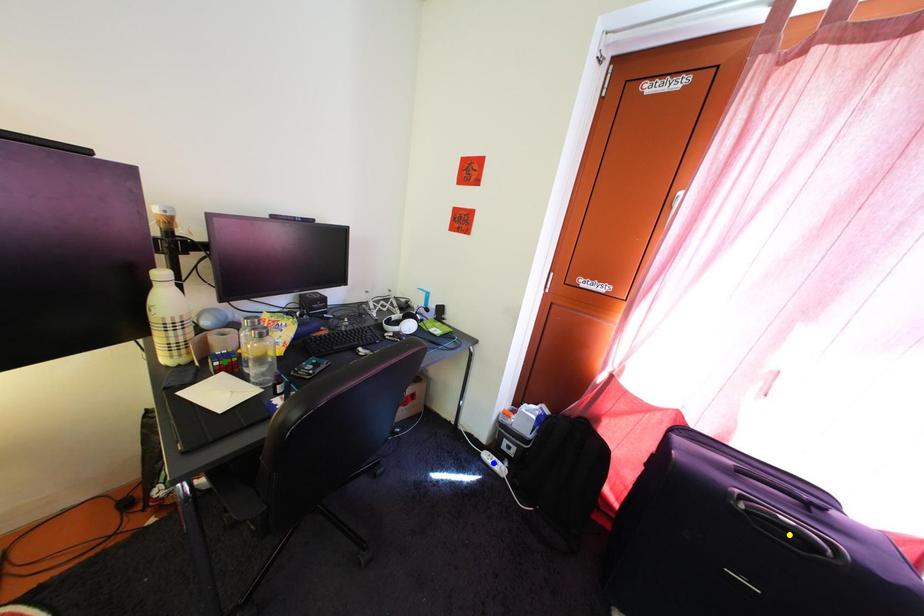
Order these from nearest to farthest:
green point | blue point | yellow point

1. yellow point
2. green point
3. blue point